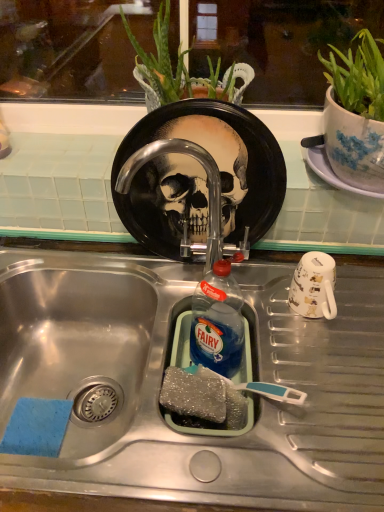
Question: Does black glossy plate at center have a smaller size compared to sparkly gray sponge at sink bottom?

Choices:
 (A) no
 (B) yes

Answer: (A)

Question: Is the position of black glossy plate at center less distant than that of sparkly gray sponge at sink bottom?

Choices:
 (A) yes
 (B) no

Answer: (B)

Question: Considering the relative sizes of black glossy plate at center and sparkly gray sponge at sink bottom in the image provided, is black glossy plate at center taller than sparkly gray sponge at sink bottom?

Choices:
 (A) no
 (B) yes

Answer: (B)

Question: Is black glossy plate at center oriented away from sparkly gray sponge at sink bottom?

Choices:
 (A) yes
 (B) no

Answer: (B)

Question: From a real-world perspective, is black glossy plate at center positioned under sparkly gray sponge at sink bottom based on gravity?

Choices:
 (A) no
 (B) yes

Answer: (A)

Question: Is black glossy plate at center outside of sparkly gray sponge at sink bottom?

Choices:
 (A) no
 (B) yes

Answer: (B)

Question: Can you confirm if white glossy mug at right is shorter than blue translucent liquid at sink center?

Choices:
 (A) no
 (B) yes

Answer: (B)

Question: Considering the relative positions of white glossy mug at right and blue translucent liquid at sink center in the image provided, is white glossy mug at right to the left of blue translucent liquid at sink center from the viewer's perspective?

Choices:
 (A) yes
 (B) no

Answer: (B)

Question: From the image's perspective, is white glossy mug at right beneath blue translucent liquid at sink center?

Choices:
 (A) yes
 (B) no

Answer: (B)

Question: From a real-world perspective, is white glossy mug at right located higher than blue translucent liquid at sink center?

Choices:
 (A) no
 (B) yes

Answer: (B)

Question: Is white glossy mug at right completely or partially outside of blue translucent liquid at sink center?

Choices:
 (A) no
 (B) yes

Answer: (B)

Question: From the image's perspective, would you say white glossy mug at right is positioned over blue translucent liquid at sink center?

Choices:
 (A) yes
 (B) no

Answer: (A)

Question: From a real-world perspective, is white glossy mug at right on top of stainless steel sink at center?

Choices:
 (A) no
 (B) yes

Answer: (B)